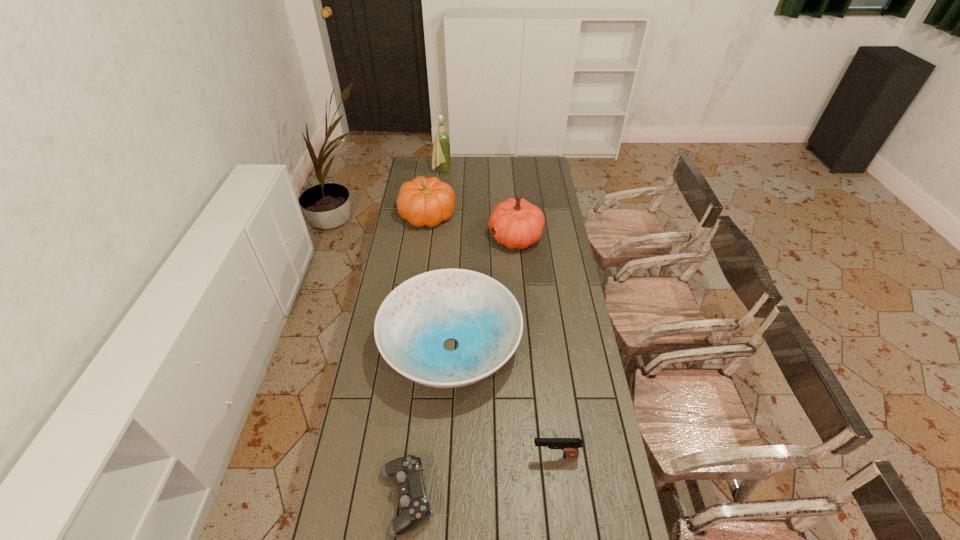
Identify the location of free location located on the front-facing side of the right pumpkin. The image size is (960, 540). (430, 237).

Find the location of `free location located on the front-facing side of the right pumpkin`. free location located on the front-facing side of the right pumpkin is located at coordinates (440, 237).

Identify the location of vacant space located 0.270m on the front of the left pumpkin. This screenshot has width=960, height=540. (420, 270).

Image resolution: width=960 pixels, height=540 pixels. I want to click on vacant area situated 0.290m on the back of the fourth tallest object, so click(456, 251).

The height and width of the screenshot is (540, 960). I want to click on vacant position located at the barrel of the fifth tallest object, so click(458, 456).

Locate an element on the screen. free space located 0.050m at the barrel of the fifth tallest object is located at coordinates (516, 456).

Locate an element on the screen. This screenshot has width=960, height=540. free space located at the barrel of the fifth tallest object is located at coordinates (452, 456).

I want to click on object at the far edge, so click(441, 150).

You are a GUI agent. You are given a task and a screenshot of the screen. Output one action in this format:
    pyautogui.click(x=<x>, y=<y>)
    Task: Click on the wine bottle located at the left edge
    This screenshot has width=960, height=540.
    Given the screenshot: What is the action you would take?
    pyautogui.click(x=441, y=150)

Where is `pumpkin located at the left edge`? The width and height of the screenshot is (960, 540). pumpkin located at the left edge is located at coordinates (423, 201).